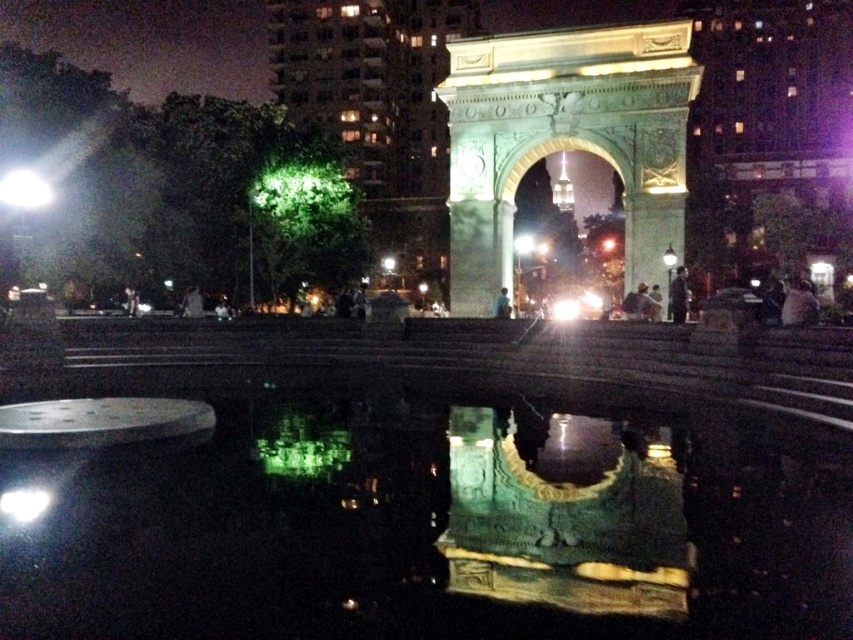
Question: Which object appears farthest from the camera in this image?

Choices:
 (A) green reflective water at center
 (B) green stone arch at center

Answer: (B)

Question: Is green reflective water at center closer to camera compared to green stone arch at center?

Choices:
 (A) no
 (B) yes

Answer: (B)

Question: Which object is farther from the camera taking this photo?

Choices:
 (A) green stone arch at center
 (B) green reflective water at center

Answer: (A)

Question: Does green reflective water at center appear on the left side of green stone arch at center?

Choices:
 (A) yes
 (B) no

Answer: (A)

Question: Which of the following is the farthest from the observer?

Choices:
 (A) click(86, 470)
 (B) click(572, 172)

Answer: (B)

Question: Does green reflective water at center have a larger size compared to green stone arch at center?

Choices:
 (A) yes
 (B) no

Answer: (B)